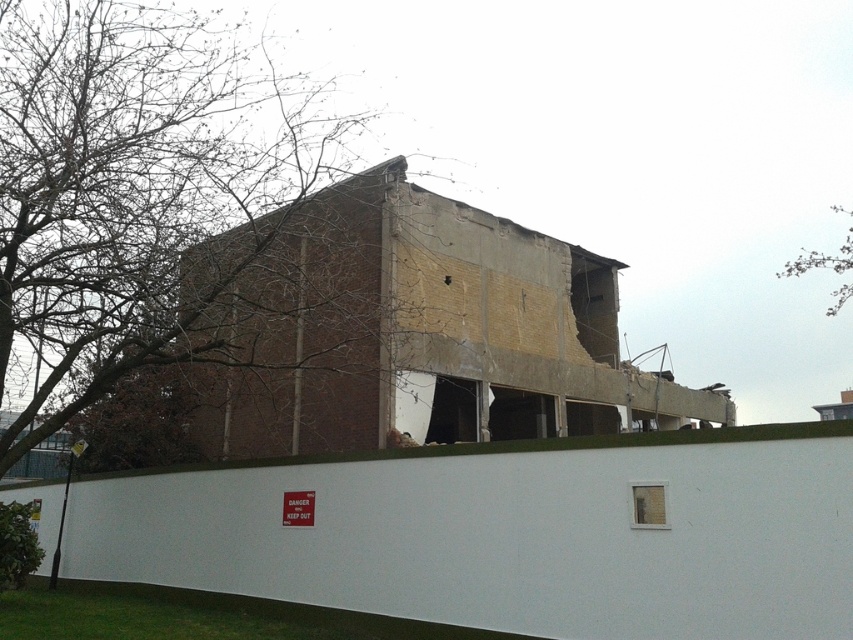
You are standing in front of the white wall with the DANGER sign. There is a point marked at coordinates (136,189). What does this point represent?

The point at (136,189) represents the location of the bare branches at upper left.